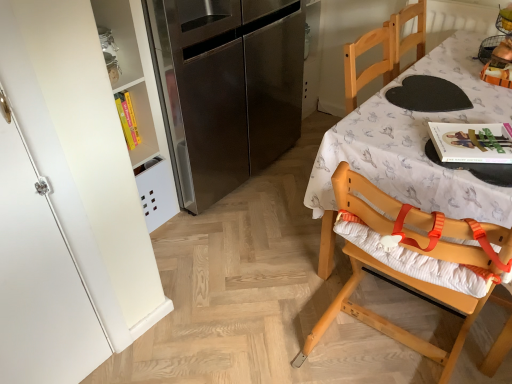
You are a GUI agent. You are given a task and a screenshot of the screen. Output one action in this format:
    pyautogui.click(x=<x>, y=<y>)
    Task: Click on the vacant space situated on the left part of wooden highchair at right
    This screenshot has width=512, height=384.
    Given the screenshot: What is the action you would take?
    pyautogui.click(x=274, y=319)